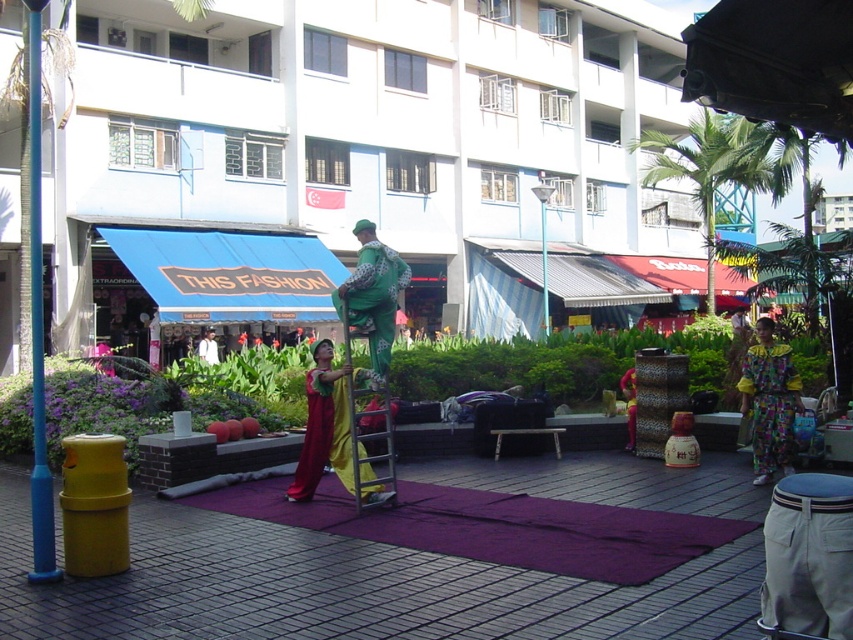
Question: Among these points, which one is nearest to the camera?

Choices:
 (A) (172, 54)
 (B) (633, 396)
 (C) (42, 328)
 (D) (209, 356)

Answer: (C)

Question: Does purple fabric mat at center lie in front of light beige fabric stilt at center?

Choices:
 (A) yes
 (B) no

Answer: (B)

Question: Is purple fabric mat at center further to the viewer compared to shiny metallic dress at center?

Choices:
 (A) no
 (B) yes

Answer: (A)

Question: Which of the following is the farthest from the observer?

Choices:
 (A) white cotton shirt at center
 (B) metallic silver ladder at center
 (C) white smooth building at center
 (D) shiny metallic dress at center

Answer: (A)

Question: Which of the following is the farthest from the observer?

Choices:
 (A) purple fabric mat at center
 (B) white smooth building at center
 (C) blue plastic pole at left

Answer: (B)

Question: Does purple fabric mat at center have a greater width compared to green fabric street artist at center?

Choices:
 (A) no
 (B) yes

Answer: (B)